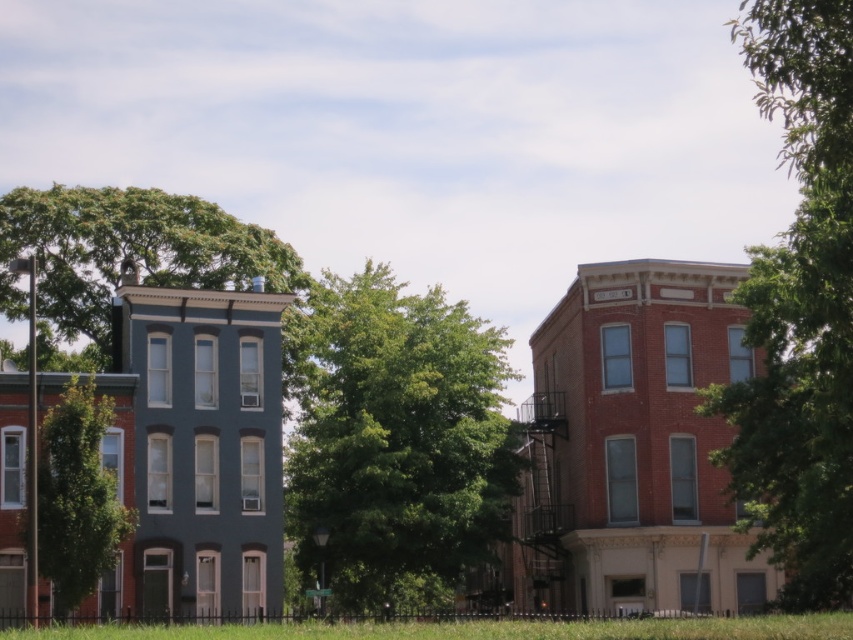
Question: Which object is the closest to the green leafy tree at upper left?

Choices:
 (A) green leafy tree at upper right
 (B) green leafy tree at left
 (C) green leafy tree at center
 (D) green grass at lower center

Answer: (C)

Question: Is green grass at lower center closer to the viewer compared to green leafy tree at left?

Choices:
 (A) no
 (B) yes

Answer: (B)

Question: Can you confirm if green leafy tree at center is smaller than green grass at lower center?

Choices:
 (A) no
 (B) yes

Answer: (A)

Question: Which of the following is the farthest from the observer?

Choices:
 (A) green leafy tree at left
 (B) green leafy tree at upper right

Answer: (A)

Question: Which is farther from the green leafy tree at left?

Choices:
 (A) green leafy tree at center
 (B) green leafy tree at upper left

Answer: (B)

Question: Does green leafy tree at center appear under green grass at lower center?

Choices:
 (A) no
 (B) yes

Answer: (A)